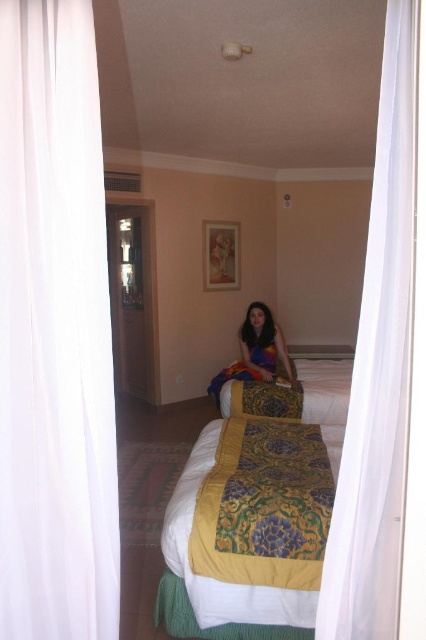
Question: Considering the real-world distances, which object is closest to the white sheer curtain at right?

Choices:
 (A) patterned fabric bed at center
 (B) multicolored fabric at center

Answer: (A)

Question: Can you confirm if white sheer curtain at left is wider than patterned fabric bed at center?

Choices:
 (A) no
 (B) yes

Answer: (A)

Question: Can you confirm if patterned fabric bed at center is positioned to the left of white sheer curtain at right?

Choices:
 (A) no
 (B) yes

Answer: (B)

Question: Which of the following is the farthest from the observer?

Choices:
 (A) white sheer curtain at left
 (B) patterned fabric bed at center
 (C) multicolored fabric at center
 (D) white sheer curtain at right

Answer: (C)

Question: Does white sheer curtain at left appear under patterned fabric bed at center?

Choices:
 (A) no
 (B) yes

Answer: (A)

Question: Based on their relative distances, which object is farther from the patterned fabric bed at center?

Choices:
 (A) multicolored fabric at center
 (B) white sheer curtain at right
 (C) white sheer curtain at left

Answer: (A)